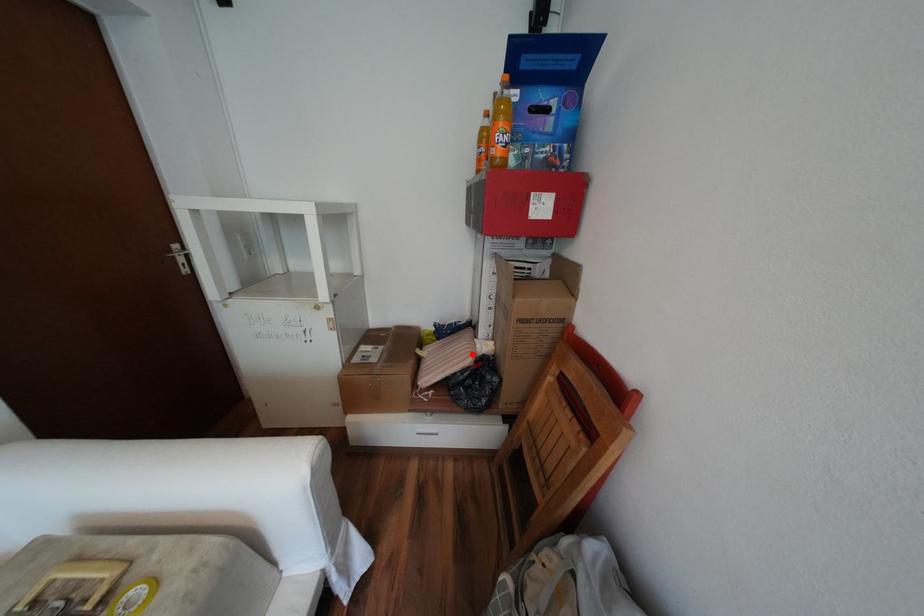
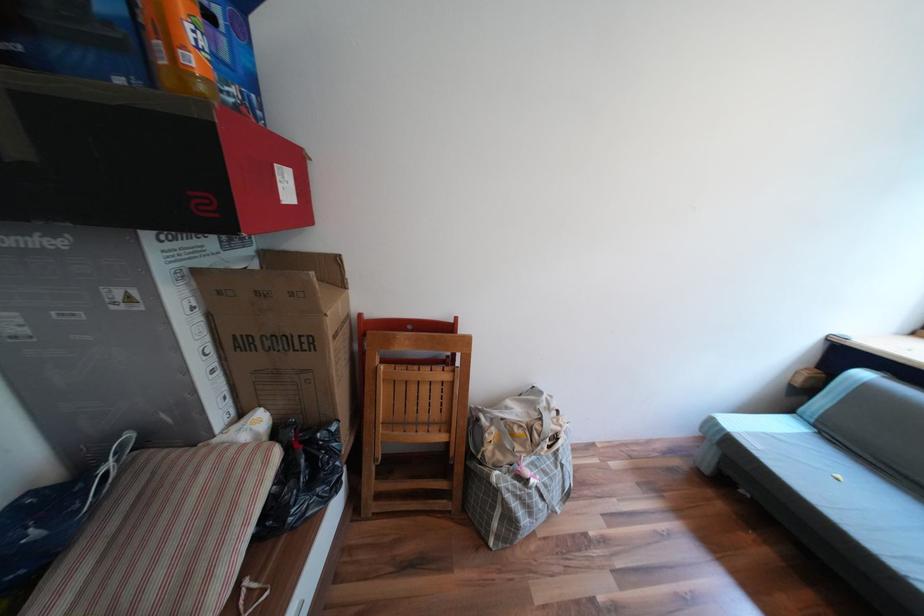
Find the pixel in the second image that matches the highlighted location in the first image.

(258, 464)